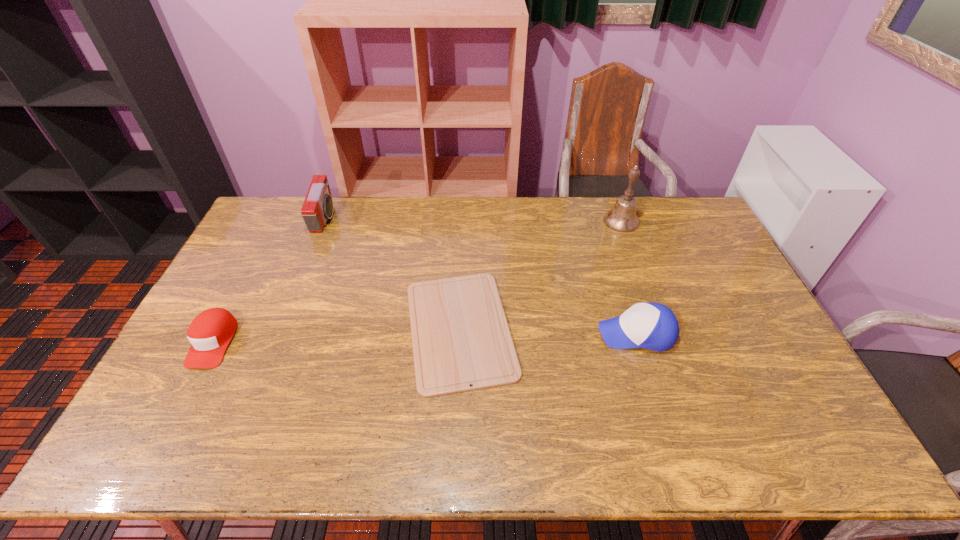
Where is `free space located 0.370m on the front-facing side of the fourth object from right to left`? This screenshot has width=960, height=540. free space located 0.370m on the front-facing side of the fourth object from right to left is located at coordinates click(433, 219).

What are the coordinates of `blank area located 0.300m on the front-facing side of the third tallest object` in the screenshot? It's located at (493, 333).

Locate an element on the screen. The image size is (960, 540). blank area located 0.050m on the front-facing side of the third tallest object is located at coordinates (580, 333).

You are a GUI agent. You are given a task and a screenshot of the screen. Output one action in this format:
    pyautogui.click(x=<x>, y=<y>)
    Task: Click on the free point located on the front-facing side of the third tallest object
    This screenshot has width=960, height=540.
    Given the screenshot: What is the action you would take?
    pyautogui.click(x=517, y=333)

Identify the location of free space located 0.180m on the front-facing side of the leftmost object. [165, 434].

I want to click on vacant area situated 0.190m on the left of the chopping board, so click(336, 329).

You are a GUI agent. You are given a task and a screenshot of the screen. Output one action in this format:
    pyautogui.click(x=<x>, y=<y>)
    Task: Click on the bell located at the far edge
    
    Given the screenshot: What is the action you would take?
    pyautogui.click(x=622, y=217)

Find the location of a particular element. Image resolution: width=960 pixels, height=540 pixels. camera that is at the far edge is located at coordinates (317, 208).

At what (x,y) coordinates should I click in order to perform the action: click on object that is at the left edge. Please return your answer as a coordinate pair (x, y). Looking at the image, I should click on (211, 331).

Locate an element on the screen. vacant area at the far edge is located at coordinates (395, 200).